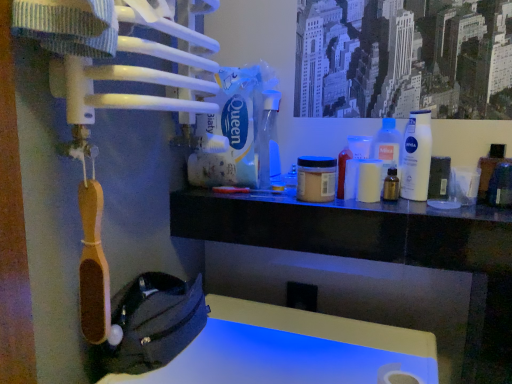
Question: Which direction should I rotate to face transparent plastic spray bottle at center, arranged as the third bottle when viewed from the right, — up or down?

Choices:
 (A) up
 (B) down

Answer: (A)

Question: Is white plastic bottle at upper right, placed as the 1th bottle when sorted from right to left, positioned beyond the bounds of transparent plastic spray bottle at center, the 1th bottle viewed from the left?

Choices:
 (A) yes
 (B) no

Answer: (A)

Question: Is white plastic bottle at upper right, placed as the 1th bottle when sorted from right to left, positioned in front of transparent plastic spray bottle at center, the 1th bottle viewed from the left?

Choices:
 (A) yes
 (B) no

Answer: (A)

Question: From a real-world perspective, is white plastic bottle at upper right, placed as the 1th bottle when sorted from right to left, positioned under transparent plastic spray bottle at center, the 1th bottle viewed from the left, based on gravity?

Choices:
 (A) no
 (B) yes

Answer: (B)

Question: Is the surface of white plastic bottle at upper right, placed as the 1th bottle when sorted from right to left, in direct contact with transparent plastic spray bottle at center, the 1th bottle viewed from the left?

Choices:
 (A) yes
 (B) no

Answer: (B)

Question: Considering the relative sizes of white plastic bottle at upper right, which appears as the third bottle when viewed from the left, and transparent plastic spray bottle at center, arranged as the third bottle when viewed from the right, in the image provided, is white plastic bottle at upper right, which appears as the third bottle when viewed from the left, wider than transparent plastic spray bottle at center, arranged as the third bottle when viewed from the right,?

Choices:
 (A) no
 (B) yes

Answer: (A)

Question: Is white plastic bottle at upper right, placed as the 1th bottle when sorted from right to left, aimed at transparent plastic spray bottle at center, arranged as the third bottle when viewed from the right?

Choices:
 (A) yes
 (B) no

Answer: (B)

Question: Does transparent plastic spray bottle at center, the 1th bottle viewed from the left, have a lesser height compared to white plastic bottle at upper right, placed as the 1th bottle when sorted from right to left?

Choices:
 (A) no
 (B) yes

Answer: (A)

Question: Considering the relative positions of transparent plastic spray bottle at center, arranged as the third bottle when viewed from the right, and white plastic bottle at upper right, placed as the 1th bottle when sorted from right to left, in the image provided, is transparent plastic spray bottle at center, arranged as the third bottle when viewed from the right, to the left of white plastic bottle at upper right, placed as the 1th bottle when sorted from right to left, from the viewer's perspective?

Choices:
 (A) yes
 (B) no

Answer: (A)

Question: Is transparent plastic spray bottle at center, the 1th bottle viewed from the left, surrounding white plastic bottle at upper right, placed as the 1th bottle when sorted from right to left?

Choices:
 (A) yes
 (B) no

Answer: (B)

Question: From a real-world perspective, is transparent plastic spray bottle at center, the 1th bottle viewed from the left, physically above white plastic bottle at upper right, which appears as the third bottle when viewed from the left?

Choices:
 (A) no
 (B) yes

Answer: (B)

Question: Is transparent plastic spray bottle at center, the 1th bottle viewed from the left, taller than white plastic bottle at upper right, which appears as the third bottle when viewed from the left?

Choices:
 (A) no
 (B) yes

Answer: (B)

Question: Is transparent plastic spray bottle at center, the 1th bottle viewed from the left, facing towards white plastic bottle at upper right, placed as the 1th bottle when sorted from right to left?

Choices:
 (A) yes
 (B) no

Answer: (B)

Question: From the image's perspective, would you say translucent amber bottle at center, which appears as the 2th bottle when viewed from the right, is shown under transparent plastic spray bottle at center, the 1th bottle viewed from the left?

Choices:
 (A) no
 (B) yes

Answer: (B)